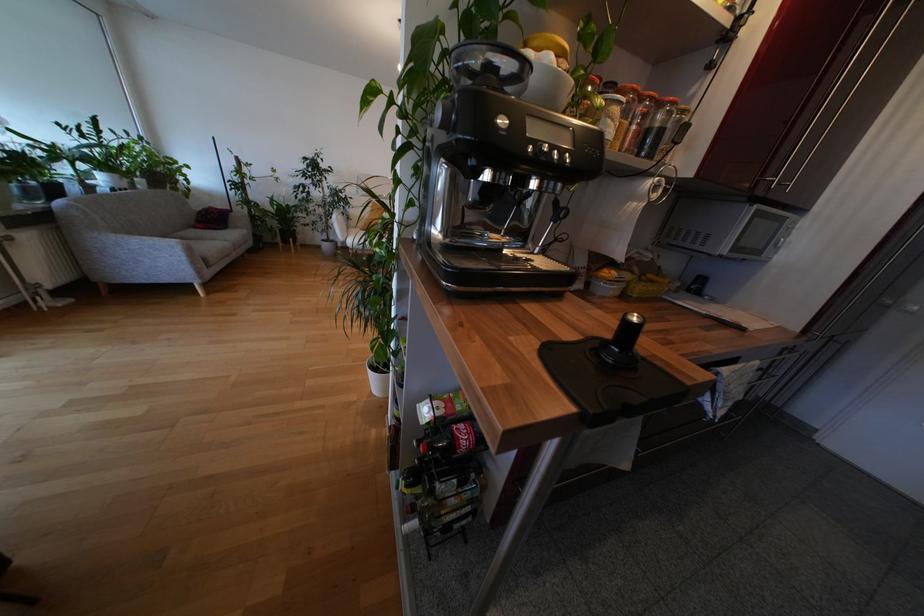
Image resolution: width=924 pixels, height=616 pixels. What are the coordinates of `sofa sitting surface` in the screenshot? It's located at (214, 235).